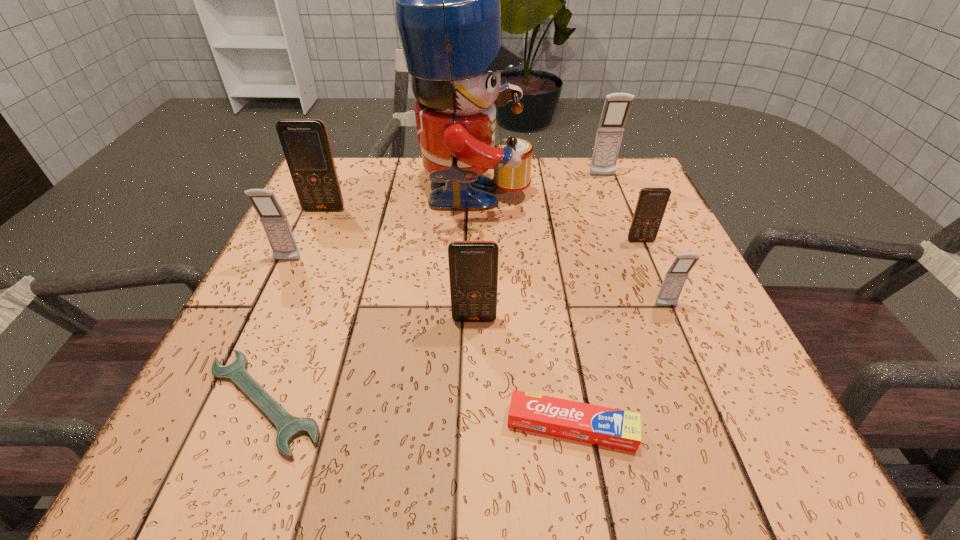
Where is `the fourth nearest cellular telephone`? the fourth nearest cellular telephone is located at coordinates (652, 202).

The height and width of the screenshot is (540, 960). In order to click on the second farthest orange cellular telephone in this screenshot , I will do `click(652, 202)`.

In order to click on the smallest gray cellular telephone in this screenshot , I will do `click(675, 278)`.

Locate an element on the screen. the fourth nearest object is located at coordinates (675, 278).

Locate an element on the screen. The image size is (960, 540). toothpaste is located at coordinates (614, 428).

I want to click on the shortest object, so click(x=289, y=427).

This screenshot has height=540, width=960. I want to click on free space located 0.100m on the front-facing side of the blue nutcracker, so click(x=571, y=202).

Image resolution: width=960 pixels, height=540 pixels. Identify the location of vacant region located 0.340m on the front-facing side of the farthest gray cellular telephone. (636, 263).

Where is `vacant area situated on the screen of the leftmost orange cellular telephone`? This screenshot has height=540, width=960. vacant area situated on the screen of the leftmost orange cellular telephone is located at coordinates click(x=314, y=233).

This screenshot has height=540, width=960. I want to click on vacant space located on the front-facing side of the second nearest gray cellular telephone, so click(237, 363).